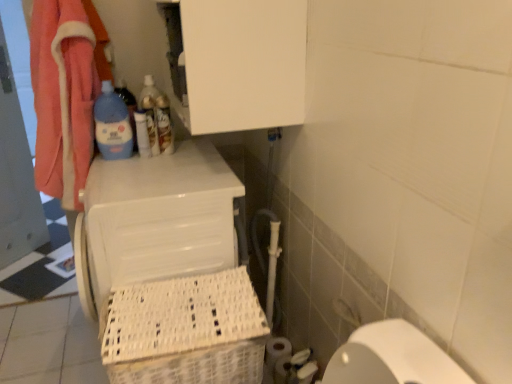
In order to click on vacant area to the right of blue glossy bottle at upper left, arranged as the first bottle when viewed from the left in this screenshot , I will do `click(167, 154)`.